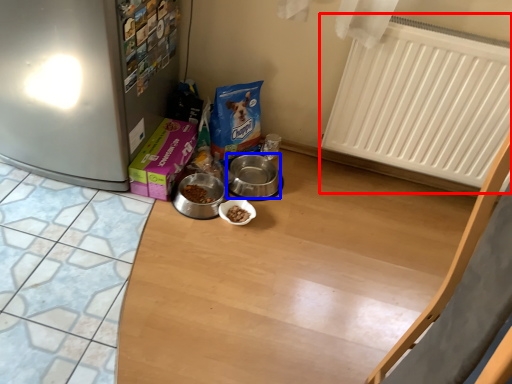
Question: Which object is closer to the camera taking this photo, radiator (highlighted by a red box) or appliance (highlighted by a blue box)?

Choices:
 (A) radiator
 (B) appliance

Answer: (A)